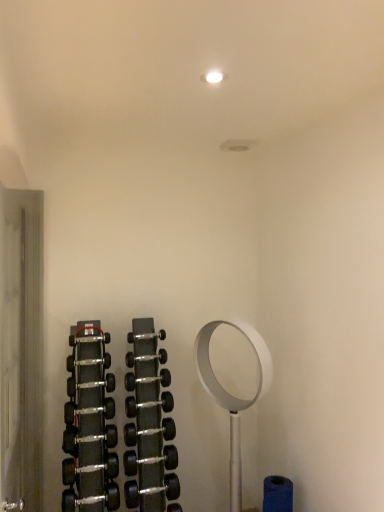
Measure the distance between point [28,507] and camera.

Point [28,507] is 2.31 meters away from camera.

Describe the element at coordinates (88, 362) in the screenshot. I see `black metallic dumbbell at center, which is the eighth dumbbell in bottom-to-top order` at that location.

Locate an element on the screen. The image size is (384, 512). black metallic dumbbell at center, the first dumbbell positioned from the bottom is located at coordinates (150, 460).

What do you see at coordinates (149, 404) in the screenshot? I see `black rubber dumbbell at center, which is the 6th dumbbell from top to bottom` at bounding box center [149, 404].

At what (x,y) coordinates should I click in order to perform the action: click on black rubber dumbbell at center, marked as the second dumbbell in a top-to-bottom arrangement. Please return your answer as a coordinate pair (x, y). Image resolution: width=384 pixels, height=512 pixels. Looking at the image, I should click on [x=145, y=358].

Describe the element at coordinates (145, 358) in the screenshot. Image resolution: width=384 pixels, height=512 pixels. I see `black rubber dumbbell at center, acting as the seventh dumbbell starting from the bottom` at that location.

What do you see at coordinates (88, 438) in the screenshot? I see `black rubber dumbbell at lower left, which is the seventh dumbbell from top to bottom` at bounding box center [88, 438].

Image resolution: width=384 pixels, height=512 pixels. Identify the location of black rubber dumbbell at center, the third dumbbell from the top. (91, 384).

I want to click on transparent wood glass door at left, so click(22, 348).

Is transparent wood glass door at left facing towards black rubber dumbbell at lower left, which appears as the 2th dumbbell when ordered from the bottom?

Yes, transparent wood glass door at left is facing black rubber dumbbell at lower left, which appears as the 2th dumbbell when ordered from the bottom.

Is transparent wood glass door at left taller than black rubber dumbbell at lower left, which is the seventh dumbbell from top to bottom?

Indeed, transparent wood glass door at left has a greater height compared to black rubber dumbbell at lower left, which is the seventh dumbbell from top to bottom.

Can you tell me how much transparent wood glass door at left and black rubber dumbbell at lower left, which appears as the 2th dumbbell when ordered from the bottom, differ in facing direction?

There is a 89.5-degree angle between the facing directions of transparent wood glass door at left and black rubber dumbbell at lower left, which appears as the 2th dumbbell when ordered from the bottom.

From the image's perspective, is black rubber dumbbell at center, which ranks as the 4th dumbbell in top-to-bottom order, above or below black metallic dumbbell at center, which is the eighth dumbbell in top-to-bottom order?

black rubber dumbbell at center, which ranks as the 4th dumbbell in top-to-bottom order, is above black metallic dumbbell at center, which is the eighth dumbbell in top-to-bottom order.

Considering the relative sizes of black rubber dumbbell at center, which ranks as the 4th dumbbell in top-to-bottom order, and black metallic dumbbell at center, the first dumbbell positioned from the bottom, in the image provided, is black rubber dumbbell at center, which ranks as the 4th dumbbell in top-to-bottom order, bigger than black metallic dumbbell at center, the first dumbbell positioned from the bottom,?

Incorrect, black rubber dumbbell at center, which ranks as the 4th dumbbell in top-to-bottom order, is not larger than black metallic dumbbell at center, the first dumbbell positioned from the bottom.

Does black rubber dumbbell at center, which ranks as the 4th dumbbell in top-to-bottom order, turn towards black metallic dumbbell at center, the first dumbbell positioned from the bottom?

No, black rubber dumbbell at center, which ranks as the 4th dumbbell in top-to-bottom order, is not facing towards black metallic dumbbell at center, the first dumbbell positioned from the bottom.

From a real-world perspective, starting from the black rubber dumbbell at center, which is the fifth dumbbell in bottom-to-top order, which dumbbell is the 4th one below it? Please provide its 2D coordinates.

[(150, 460)]

From a real-world perspective, is black metallic dumbbell at center, the first dumbbell positioned from the bottom, positioned under black rubber dumbbell at center, which ranks as the 4th dumbbell in top-to-bottom order, based on gravity?

Yes, from a real-world perspective, black metallic dumbbell at center, the first dumbbell positioned from the bottom, is below black rubber dumbbell at center, which ranks as the 4th dumbbell in top-to-bottom order.

You are a GUI agent. You are given a task and a screenshot of the screen. Output one action in this format:
    pyautogui.click(x=<x>, y=<y>)
    Task: Click on the 2nd dumbbell to the right of the black rubber dumbbell at center, which ranks as the 4th dumbbell in top-to-bottom order, starting your count from the anchor
    The width and height of the screenshot is (384, 512).
    Given the screenshot: What is the action you would take?
    pyautogui.click(x=150, y=460)

Based on their positions, is black metallic dumbbell at center, the first dumbbell positioned from the bottom, located to the left or right of black rubber dumbbell at center, which is the fifth dumbbell in bottom-to-top order?

Clearly, black metallic dumbbell at center, the first dumbbell positioned from the bottom, is on the right of black rubber dumbbell at center, which is the fifth dumbbell in bottom-to-top order, in the image.

Is black metallic dumbbell at center, the first dumbbell positioned from the bottom, aimed at black rubber dumbbell at center, which is the fifth dumbbell in bottom-to-top order?

No, black metallic dumbbell at center, the first dumbbell positioned from the bottom, is not turned towards black rubber dumbbell at center, which is the fifth dumbbell in bottom-to-top order.

Would you say black rubber dumbbell at left, arranged as the fifth dumbbell when viewed from the top, is outside black rubber dumbbell at center, marked as the second dumbbell in a top-to-bottom arrangement?

Indeed, black rubber dumbbell at left, arranged as the fifth dumbbell when viewed from the top, is completely outside black rubber dumbbell at center, marked as the second dumbbell in a top-to-bottom arrangement.

Could you tell me if black rubber dumbbell at left, the 4th dumbbell ordered from the bottom, is facing black rubber dumbbell at center, acting as the seventh dumbbell starting from the bottom?

No, black rubber dumbbell at left, the 4th dumbbell ordered from the bottom, is not aimed at black rubber dumbbell at center, acting as the seventh dumbbell starting from the bottom.

Looking at this image, does black rubber dumbbell at left, arranged as the fifth dumbbell when viewed from the top, touch black rubber dumbbell at center, marked as the second dumbbell in a top-to-bottom arrangement?

No, black rubber dumbbell at left, arranged as the fifth dumbbell when viewed from the top, is not with black rubber dumbbell at center, marked as the second dumbbell in a top-to-bottom arrangement.

Is black rubber dumbbell at left, the 4th dumbbell ordered from the bottom, further to the viewer compared to black rubber dumbbell at center, marked as the second dumbbell in a top-to-bottom arrangement?

That is False.

Is black rubber dumbbell at lower left, which appears as the 2th dumbbell when ordered from the bottom, facing towards black rubber dumbbell at left, the 4th dumbbell ordered from the bottom?

No.

From the image's perspective, which is below, black rubber dumbbell at lower left, which appears as the 2th dumbbell when ordered from the bottom, or black rubber dumbbell at left, arranged as the fifth dumbbell when viewed from the top?

From the image's view, black rubber dumbbell at lower left, which appears as the 2th dumbbell when ordered from the bottom, is below.

Considering the sizes of black rubber dumbbell at lower left, which is the seventh dumbbell from top to bottom, and black rubber dumbbell at left, the 4th dumbbell ordered from the bottom, in the image, is black rubber dumbbell at lower left, which is the seventh dumbbell from top to bottom, bigger or smaller than black rubber dumbbell at left, the 4th dumbbell ordered from the bottom,?

Clearly, black rubber dumbbell at lower left, which is the seventh dumbbell from top to bottom, is larger in size than black rubber dumbbell at left, the 4th dumbbell ordered from the bottom.

Relative to black rubber dumbbell at left, the 4th dumbbell ordered from the bottom, is black rubber dumbbell at lower left, which is the seventh dumbbell from top to bottom, in front or behind?

black rubber dumbbell at lower left, which is the seventh dumbbell from top to bottom, is in front of black rubber dumbbell at left, the 4th dumbbell ordered from the bottom.

Between point (78, 410) and point (90, 362), which one is positioned in front?

Point (78, 410)

In the scene shown: From the image's perspective, is black rubber dumbbell at left, arranged as the fifth dumbbell when viewed from the top, beneath black metallic dumbbell at center, which is the eighth dumbbell in bottom-to-top order?

Yes.

Is black rubber dumbbell at left, the 4th dumbbell ordered from the bottom, at the left side of black metallic dumbbell at center, marked as the first dumbbell in a top-to-bottom arrangement?

No, black rubber dumbbell at left, the 4th dumbbell ordered from the bottom, is not to the left of black metallic dumbbell at center, marked as the first dumbbell in a top-to-bottom arrangement.

In the scene shown: Is black rubber dumbbell at left, arranged as the fifth dumbbell when viewed from the top, positioned beyond the bounds of black metallic dumbbell at center, which is the eighth dumbbell in bottom-to-top order?

That's correct, black rubber dumbbell at left, arranged as the fifth dumbbell when viewed from the top, is outside of black metallic dumbbell at center, which is the eighth dumbbell in bottom-to-top order.

Between black rubber dumbbell at center, which is the 6th dumbbell in bottom-to-top order, and black rubber dumbbell at center, acting as the seventh dumbbell starting from the bottom, which one is positioned behind?

black rubber dumbbell at center, acting as the seventh dumbbell starting from the bottom.

Would you say black rubber dumbbell at center, acting as the seventh dumbbell starting from the bottom, is part of black rubber dumbbell at center, the third dumbbell from the top,'s contents?

That's incorrect, black rubber dumbbell at center, acting as the seventh dumbbell starting from the bottom, is not inside black rubber dumbbell at center, the third dumbbell from the top.

From a real-world perspective, relative to black rubber dumbbell at center, marked as the second dumbbell in a top-to-bottom arrangement, is black rubber dumbbell at center, the third dumbbell from the top, vertically above or below?

black rubber dumbbell at center, the third dumbbell from the top, is situated lower than black rubber dumbbell at center, marked as the second dumbbell in a top-to-bottom arrangement, in the real world.

Where is `the 7th dumbbell below the transparent wood glass door at left (from the image's perspective)`? This screenshot has height=512, width=384. the 7th dumbbell below the transparent wood glass door at left (from the image's perspective) is located at coordinates (88, 438).

Locate an element on the screen. The width and height of the screenshot is (384, 512). dumbbell that is the 4th object located above the black metallic dumbbell at center, which is the eighth dumbbell in top-to-bottom order (from the image's perspective) is located at coordinates (147, 379).

Considering their positions, is black metallic dumbbell at center, which is the eighth dumbbell in top-to-bottom order, positioned closer to black rubber dumbbell at lower left, which is the seventh dumbbell from top to bottom, than black rubber dumbbell at center, which ranks as the 4th dumbbell in top-to-bottom order?

black metallic dumbbell at center, which is the eighth dumbbell in top-to-bottom order, lies closer to black rubber dumbbell at lower left, which is the seventh dumbbell from top to bottom, than the other object.

Based on their spatial positions, is black rubber dumbbell at center, which ranks as the 4th dumbbell in top-to-bottom order, or black rubber dumbbell at lower left, which is the seventh dumbbell from top to bottom, further from transparent wood glass door at left?

black rubber dumbbell at center, which ranks as the 4th dumbbell in top-to-bottom order, is positioned further to the anchor transparent wood glass door at left.

Estimate the real-world distances between objects in this image. Which object is further from black metallic dumbbell at center, which is the eighth dumbbell in top-to-bottom order, black rubber dumbbell at lower left, which is the seventh dumbbell from top to bottom, or transparent wood glass door at left?

transparent wood glass door at left is positioned further to the anchor black metallic dumbbell at center, which is the eighth dumbbell in top-to-bottom order.

Considering their positions, is transparent wood glass door at left positioned closer to black rubber dumbbell at left, arranged as the fifth dumbbell when viewed from the top, than black rubber dumbbell at lower left, which appears as the 2th dumbbell when ordered from the bottom?

black rubber dumbbell at lower left, which appears as the 2th dumbbell when ordered from the bottom.

Looking at the image, which one is located further to black rubber dumbbell at center, acting as the seventh dumbbell starting from the bottom, black rubber dumbbell at lower left, which is the seventh dumbbell from top to bottom, or black rubber dumbbell at center, which is the 6th dumbbell from top to bottom?

black rubber dumbbell at lower left, which is the seventh dumbbell from top to bottom, is positioned further to the anchor black rubber dumbbell at center, acting as the seventh dumbbell starting from the bottom.

Estimate the real-world distances between objects in this image. Which object is closer to black rubber dumbbell at left, the 4th dumbbell ordered from the bottom, black rubber dumbbell at center, marked as the second dumbbell in a top-to-bottom arrangement, or black rubber dumbbell at center, the third dumbbell positioned from the bottom?

Based on the image, black rubber dumbbell at center, the third dumbbell positioned from the bottom, appears to be nearer to black rubber dumbbell at left, the 4th dumbbell ordered from the bottom.

Looking at the image, which one is located closer to transparent wood glass door at left, black rubber dumbbell at lower left, which appears as the 2th dumbbell when ordered from the bottom, or black rubber dumbbell at center, the third dumbbell positioned from the bottom?

black rubber dumbbell at lower left, which appears as the 2th dumbbell when ordered from the bottom, is positioned closer to the anchor transparent wood glass door at left.

Looking at the image, which one is located closer to black rubber dumbbell at left, the 4th dumbbell ordered from the bottom, black rubber dumbbell at center, which is the 6th dumbbell from top to bottom, or transparent wood glass door at left?

Among the two, black rubber dumbbell at center, which is the 6th dumbbell from top to bottom, is located nearer to black rubber dumbbell at left, the 4th dumbbell ordered from the bottom.

Where is `dumbbell between transparent wood glass door at left and black rubber dumbbell at left, arranged as the fifth dumbbell when viewed from the top, along the z-axis`? dumbbell between transparent wood glass door at left and black rubber dumbbell at left, arranged as the fifth dumbbell when viewed from the top, along the z-axis is located at coordinates (88, 438).